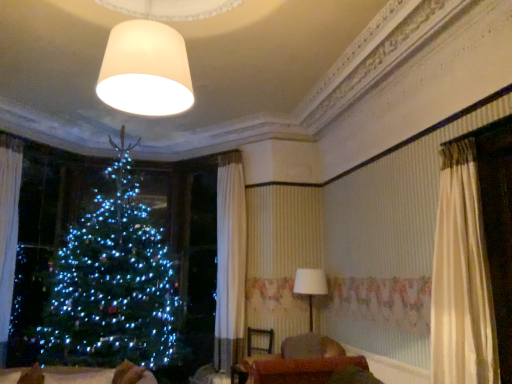
Question: From the image's perspective, would you say velvet brown sofa at lower center is shown under white sheer curtain at left?

Choices:
 (A) yes
 (B) no

Answer: (A)

Question: Is velvet brown sofa at lower center not inside white sheer curtain at left?

Choices:
 (A) no
 (B) yes

Answer: (B)

Question: Considering the relative sizes of velvet brown sofa at lower center and white sheer curtain at left in the image provided, is velvet brown sofa at lower center bigger than white sheer curtain at left?

Choices:
 (A) yes
 (B) no

Answer: (A)

Question: Can you confirm if velvet brown sofa at lower center is positioned to the right of white sheer curtain at left?

Choices:
 (A) no
 (B) yes

Answer: (B)

Question: Is velvet brown sofa at lower center oriented towards white sheer curtain at left?

Choices:
 (A) yes
 (B) no

Answer: (B)

Question: Considering the relative positions of white fabric lampshade at center, the first lamp in the bottom-to-top sequence, and white sheer curtain at left in the image provided, is white fabric lampshade at center, the first lamp in the bottom-to-top sequence, to the left or to the right of white sheer curtain at left?

Choices:
 (A) right
 (B) left

Answer: (A)

Question: In the image, is white fabric lampshade at center, acting as the 2th lamp starting from the left, positioned in front of or behind white sheer curtain at left?

Choices:
 (A) front
 (B) behind

Answer: (B)

Question: From a real-world perspective, is white fabric lampshade at center, which is the 2th lamp from top to bottom, positioned above or below white sheer curtain at left?

Choices:
 (A) below
 (B) above

Answer: (A)

Question: Does point (317, 273) appear closer or farther from the camera than point (4, 215)?

Choices:
 (A) farther
 (B) closer

Answer: (A)

Question: Is white sheer curtain at left in front of or behind velvet brown sofa at lower center in the image?

Choices:
 (A) front
 (B) behind

Answer: (B)

Question: Do you think white sheer curtain at left is within velvet brown sofa at lower center, or outside of it?

Choices:
 (A) inside
 (B) outside

Answer: (B)

Question: Does point (8, 200) appear closer or farther from the camera than point (310, 342)?

Choices:
 (A) closer
 (B) farther

Answer: (B)

Question: Looking at their shapes, would you say white sheer curtain at left is wider or thinner than velvet brown sofa at lower center?

Choices:
 (A) wide
 (B) thin

Answer: (B)

Question: Considering the positions of velvet brown sofa at lower center and white fabric lampshade at center, acting as the 2th lamp starting from the left, in the image, is velvet brown sofa at lower center wider or thinner than white fabric lampshade at center, acting as the 2th lamp starting from the left,?

Choices:
 (A) thin
 (B) wide

Answer: (B)

Question: Do you think velvet brown sofa at lower center is within white fabric lampshade at center, the 1th lamp positioned from the right, or outside of it?

Choices:
 (A) inside
 (B) outside

Answer: (B)